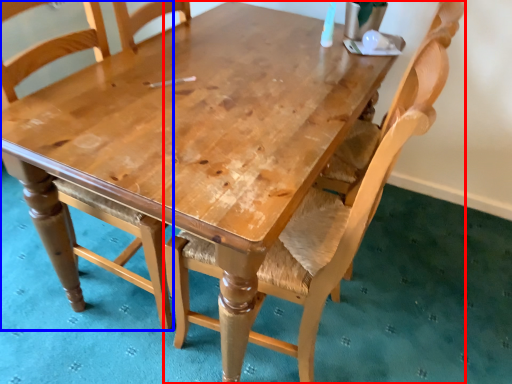
Question: Which of the following is the farthest to the observer, chair (highlighted by a red box) or chair (highlighted by a blue box)?

Choices:
 (A) chair
 (B) chair

Answer: (B)